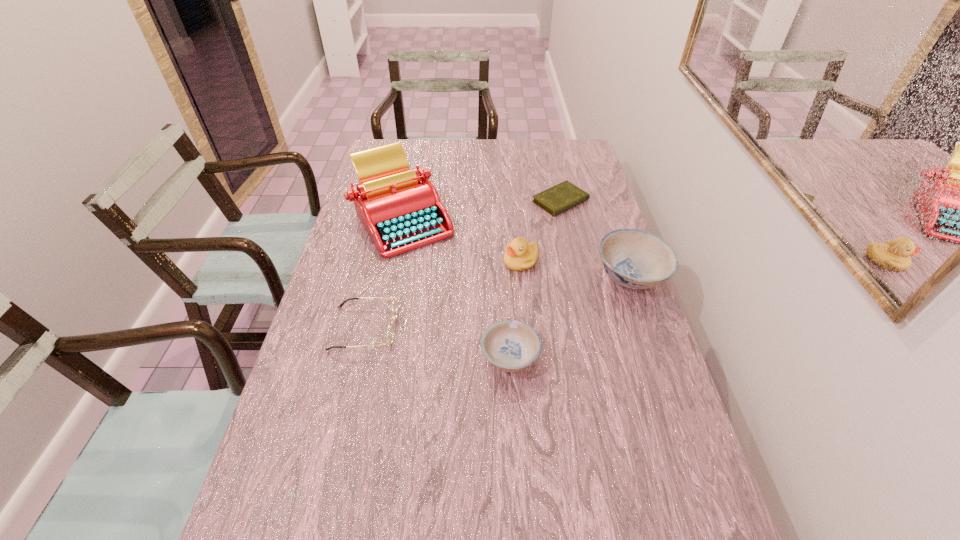
The bowls are evenly distributed in the image. To maintain this, where would you place another bowl on the left? Please point to a free space. Please provide its 2D coordinates. Your answer should be formatted as a tuple, i.e. [(x, y)], where the tuple contains the x and y coordinates of a point satisfying the conditions above.

[(332, 476)]